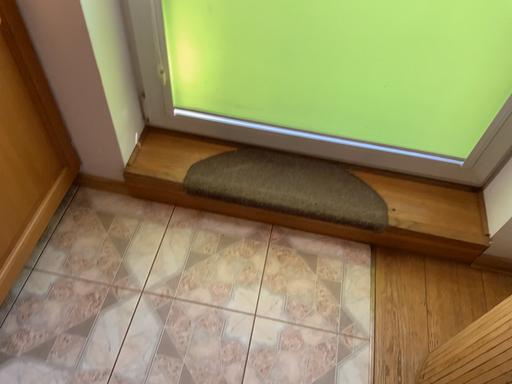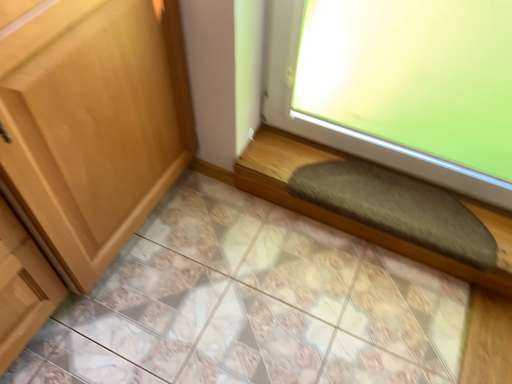
Question: Which way did the camera rotate in the video?

Choices:
 (A) rotated left
 (B) rotated right

Answer: (A)